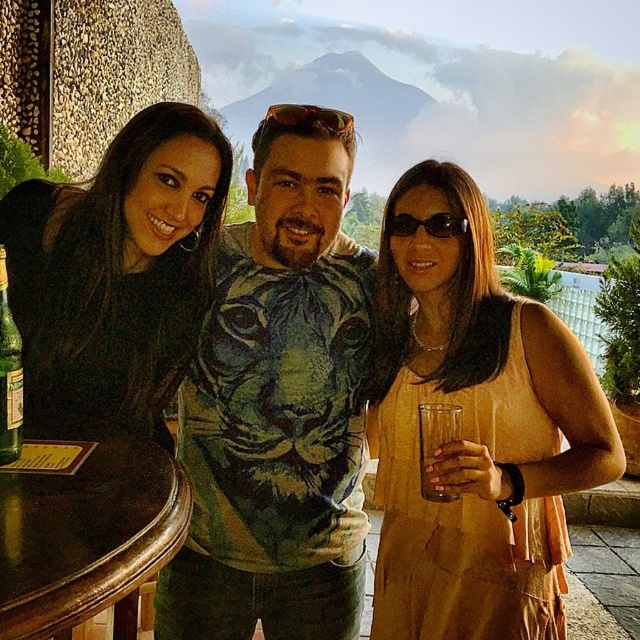
Does black matte shirt at center appear over transparent glass at right?

Correct, black matte shirt at center is located above transparent glass at right.

This screenshot has width=640, height=640. What do you see at coordinates (116, 273) in the screenshot? I see `black matte shirt at center` at bounding box center [116, 273].

Who is more distant from viewer, (141, 420) or (445, 497)?

The point (141, 420) is behind.

The width and height of the screenshot is (640, 640). What are the coordinates of `black matte shirt at center` in the screenshot? It's located at (116, 273).

Which of these two, transparent glass at right or green matte sunglasses at center, stands shorter?

Standing shorter between the two is green matte sunglasses at center.

Does transparent glass at right lie behind green matte sunglasses at center?

No, transparent glass at right is in front of green matte sunglasses at center.

Which is behind, point (436, 490) or point (291, 115)?

The point (291, 115) is more distant.

The width and height of the screenshot is (640, 640). Identify the location of transparent glass at right. (435, 442).

In the scene shown: Is brown wood table at lower left to the left of sunglasses at center from the viewer's perspective?

Yes, brown wood table at lower left is to the left of sunglasses at center.

Measure the distance between brown wood table at lower left and camera.

brown wood table at lower left is 24.73 inches from camera.

I want to click on brown wood table at lower left, so click(x=88, y=538).